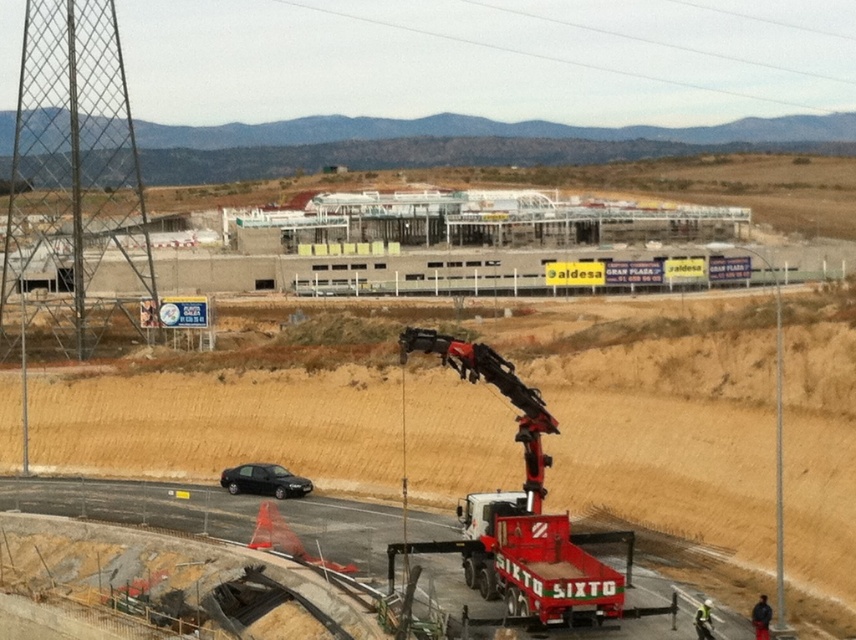
Question: Which of the following is the closest to the observer?

Choices:
 (A) red matte trailer truck at lower right
 (B) black asphalt highway at lower center
 (C) black matte sedan at lower left
 (D) white concrete building at center

Answer: (B)

Question: Which of the following is the closest to the observer?

Choices:
 (A) (286, 477)
 (B) (740, 195)
 (C) (623, 536)

Answer: (C)

Question: Is red matte trailer truck at lower right above black asphalt highway at lower center?

Choices:
 (A) no
 (B) yes

Answer: (A)

Question: Does red matte trailer truck at lower right have a larger size compared to black asphalt highway at lower center?

Choices:
 (A) yes
 (B) no

Answer: (B)

Question: In this image, where is black asphalt highway at lower center located relative to black matte sedan at lower left?

Choices:
 (A) below
 (B) above

Answer: (A)

Question: Among these objects, which one is farthest from the camera?

Choices:
 (A) white concrete building at center
 (B) black asphalt highway at lower center
 (C) red matte trailer truck at lower right

Answer: (A)